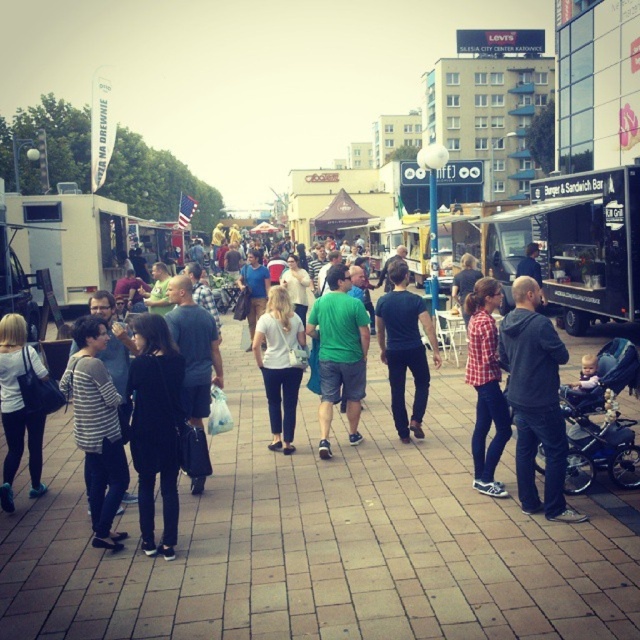
Question: Is black matte dress at center smaller than striped sweater at center?

Choices:
 (A) yes
 (B) no

Answer: (A)

Question: Which point is farther from the camera taking this photo?

Choices:
 (A) (195, 483)
 (B) (134, 470)
 (C) (272, 308)
 (D) (528, 625)

Answer: (C)

Question: Is checkered fabric shirt at center above white matte shirt at center?

Choices:
 (A) no
 (B) yes

Answer: (A)

Question: Among these objects, which one is farthest from the camera?

Choices:
 (A) white matte food truck at left
 (B) matte black jacket at lower left
 (C) black matte dress at center
 (D) white matte shirt at center

Answer: (A)

Question: Is brick pavement at center positioned behind dark gray hoodie at center?

Choices:
 (A) yes
 (B) no

Answer: (B)

Question: Which point is farther to the camera?

Choices:
 (A) (483, 336)
 (B) (531, 193)
 (C) (113, 244)

Answer: (C)